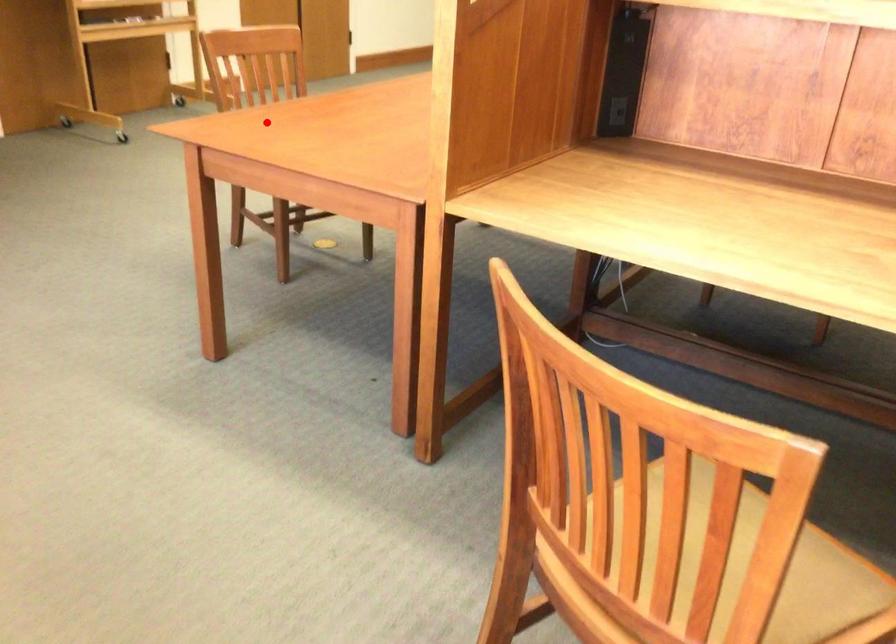
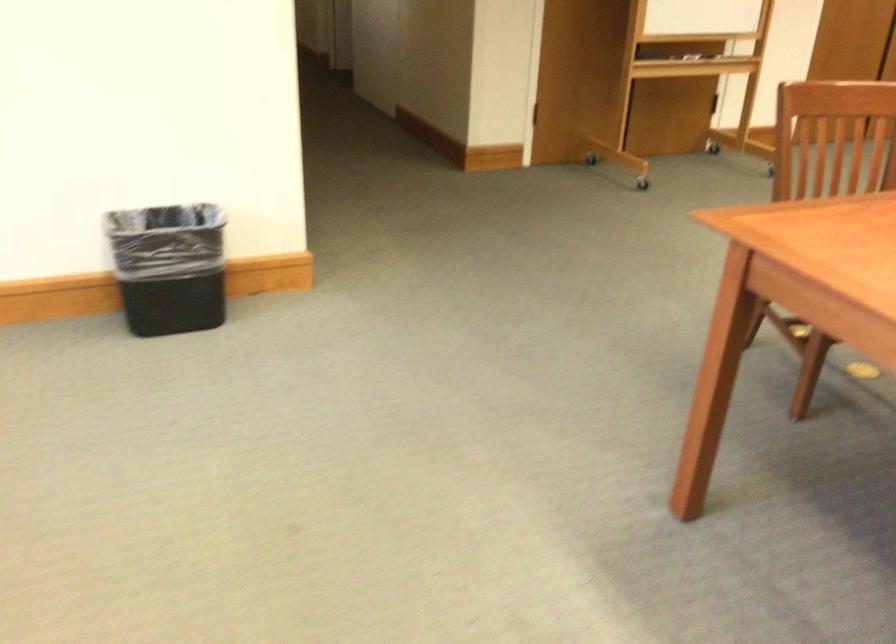
The point at the highlighted location is marked in the first image. Where is the corresponding point in the second image?

(849, 220)